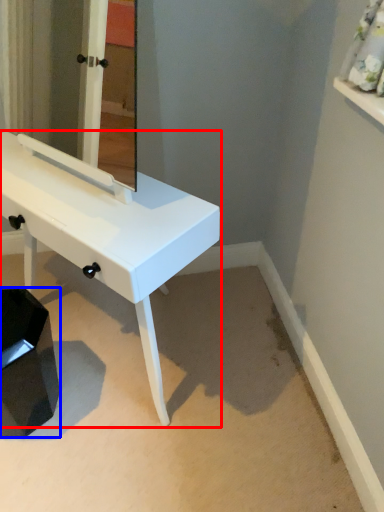
Question: Which object is further to the camera taking this photo, table (highlighted by a red box) or step stool (highlighted by a blue box)?

Choices:
 (A) table
 (B) step stool

Answer: (B)